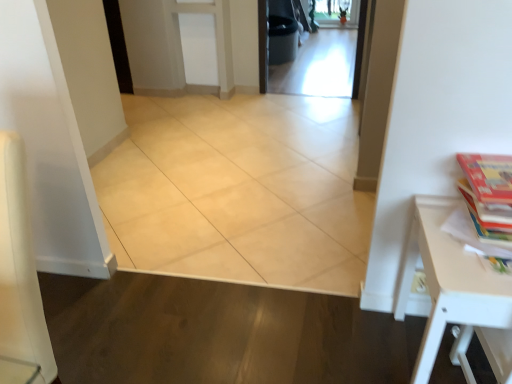
This screenshot has width=512, height=384. Describe the element at coordinates (449, 286) in the screenshot. I see `white matte table at right` at that location.

In order to face beige ceramic tile at center, should I rotate leftwards or rightwards?

You should rotate left by 6.625 degrees.

The image size is (512, 384). Find the location of `transparent glass screen door at center`. transparent glass screen door at center is located at coordinates (306, 53).

Are transparent glass screen door at center and multicolored paper book at right located far from each other?

transparent glass screen door at center is far away from multicolored paper book at right.

Considering the positions of point (362, 45) and point (480, 226), is point (362, 45) closer or farther from the camera than point (480, 226)?

Point (362, 45) is positioned farther from the camera compared to point (480, 226).

From the image's perspective, is beige ceramic tile at center over white matte table at right?

Yes, from the image's perspective, beige ceramic tile at center is over white matte table at right.

Considering the positions of points (307, 192) and (471, 326), is point (307, 192) farther from camera compared to point (471, 326)?

That is True.

Considering the sizes of beige ceramic tile at center and white matte table at right in the image, is beige ceramic tile at center wider or thinner than white matte table at right?

Clearly, beige ceramic tile at center has more width compared to white matte table at right.

Are beige ceramic tile at center and white matte table at right located far from each other?

Yes, beige ceramic tile at center and white matte table at right are located far from each other.

From a real-world perspective, which object rests below the other?

From a 3D spatial view, white matte table at right is below.

Looking at their sizes, would you say multicolored paper book at right is wider or thinner than white matte table at right?

Considering their sizes, multicolored paper book at right looks slimmer than white matte table at right.

Is multicolored paper book at right inside the boundaries of white matte table at right, or outside?

multicolored paper book at right exists outside the volume of white matte table at right.

Is multicolored paper book at right next to transparent glass screen door at center?

No, multicolored paper book at right is not next to transparent glass screen door at center.

Is multicolored paper book at right looking in the opposite direction of transparent glass screen door at center?

No.

Is multicolored paper book at right taller or shorter than transparent glass screen door at center?

Clearly, multicolored paper book at right is taller compared to transparent glass screen door at center.

Which object is thinner, multicolored paper book at right or transparent glass screen door at center?

Thinner between the two is multicolored paper book at right.

Measure the distance from white matte table at right to beige ceramic tile at center.

white matte table at right and beige ceramic tile at center are 3.52 feet apart.

Find the location of a particular element. The image size is (512, 384). table on the right of beige ceramic tile at center is located at coordinates (449, 286).

Considering the relative positions of white matte table at right and beige ceramic tile at center in the image provided, is white matte table at right to the right of beige ceramic tile at center from the viewer's perspective?

Yes.

Based on the photo, is beige ceramic tile at center beside transparent glass screen door at center?

No, beige ceramic tile at center is not beside transparent glass screen door at center.

Who is taller, beige ceramic tile at center or transparent glass screen door at center?

beige ceramic tile at center.

Would you say beige ceramic tile at center is inside or outside transparent glass screen door at center?

beige ceramic tile at center exists outside the volume of transparent glass screen door at center.

From the image's perspective, which is above, beige ceramic tile at center or transparent glass screen door at center?

transparent glass screen door at center appears higher in the image.

Which object is positioned more to the right, white matte table at right or multicolored paper book at right?

Positioned to the right is multicolored paper book at right.

Is white matte table at right touching multicolored paper book at right?

No.

Is white matte table at right shorter than multicolored paper book at right?

No, white matte table at right is not shorter than multicolored paper book at right.

Where is `screen door directly beneath the multicolored paper book at right (from a real-world perspective)`? This screenshot has height=384, width=512. screen door directly beneath the multicolored paper book at right (from a real-world perspective) is located at coordinates (306, 53).

Identify the location of table located on the right of beige ceramic tile at center. The image size is (512, 384). [449, 286].

Which object lies further to the anchor point multicolored paper book at right, transparent glass screen door at center or white matte table at right?

The object further to multicolored paper book at right is transparent glass screen door at center.

Considering their positions, is white matte table at right positioned further to beige ceramic tile at center than transparent glass screen door at center?

Among the two, transparent glass screen door at center is located further to beige ceramic tile at center.

When comparing their distances from transparent glass screen door at center, does beige ceramic tile at center or white matte table at right seem closer?

The object closer to transparent glass screen door at center is beige ceramic tile at center.

Which object lies further to the anchor point beige ceramic tile at center, multicolored paper book at right or transparent glass screen door at center?

transparent glass screen door at center.

Which object lies nearer to the anchor point multicolored paper book at right, beige ceramic tile at center or white matte table at right?

white matte table at right lies closer to multicolored paper book at right than the other object.

Looking at the image, which one is located closer to transparent glass screen door at center, white matte table at right or beige ceramic tile at center?

beige ceramic tile at center is closer to transparent glass screen door at center.

When comparing their distances from beige ceramic tile at center, does white matte table at right or multicolored paper book at right seem further?

multicolored paper book at right is positioned further to the anchor beige ceramic tile at center.

Based on their spatial positions, is transparent glass screen door at center or multicolored paper book at right further from beige ceramic tile at center?

The object further to beige ceramic tile at center is transparent glass screen door at center.

This screenshot has width=512, height=384. I want to click on book between white matte table at right and transparent glass screen door at center along the z-axis, so click(488, 193).

Find the location of a particular element. This screenshot has width=512, height=384. ceramic tile positioned between white matte table at right and transparent glass screen door at center from near to far is located at coordinates (239, 191).

Locate an element on the screen. table between beige ceramic tile at center and multicolored paper book at right in the horizontal direction is located at coordinates (449, 286).

At what (x,y) coordinates should I click in order to perform the action: click on ceramic tile located between multicolored paper book at right and transparent glass screen door at center in the depth direction. Please return your answer as a coordinate pair (x, y). The height and width of the screenshot is (384, 512). Looking at the image, I should click on (239, 191).